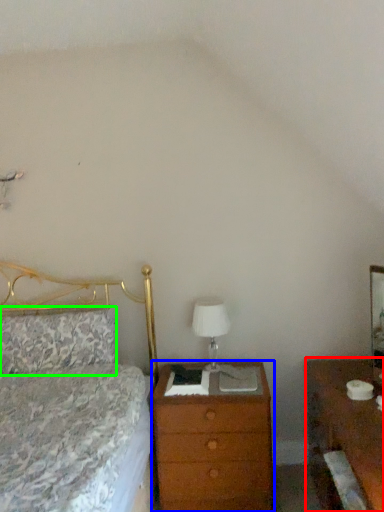
Question: Considering the real-world distances, which object is farthest from nightstand (highlighted by a red box)? chest of drawers (highlighted by a blue box) or pillow (highlighted by a green box)?

Choices:
 (A) chest of drawers
 (B) pillow

Answer: (B)